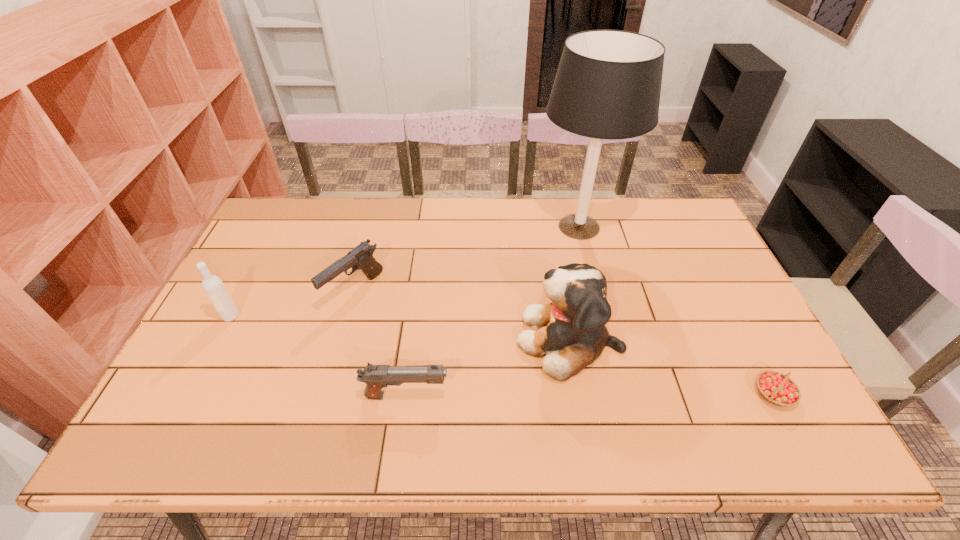
Find the location of a particular element. The width and height of the screenshot is (960, 540). the shortest object is located at coordinates (778, 389).

The width and height of the screenshot is (960, 540). Identify the location of free region located 0.150m on the left of the farthest object. (490, 227).

Where is `vacant space positioned 0.340m at the face of the puppy`? vacant space positioned 0.340m at the face of the puppy is located at coordinates (387, 340).

Find the location of a particular element. The width and height of the screenshot is (960, 540). vacant space located 0.080m at the face of the puppy is located at coordinates (486, 340).

The width and height of the screenshot is (960, 540). What are the coordinates of `vacant space located at the face of the puppy` in the screenshot? It's located at (418, 340).

Image resolution: width=960 pixels, height=540 pixels. Identify the location of vacant point located on the front of the leftmost object. pos(198,380).

This screenshot has width=960, height=540. Find the location of `vacant space located 0.240m at the muzzle of the fifth object from right to left`. vacant space located 0.240m at the muzzle of the fifth object from right to left is located at coordinates (326, 393).

Where is `vacant space located in the direction the fourth object from right to left is aimed`? The width and height of the screenshot is (960, 540). vacant space located in the direction the fourth object from right to left is aimed is located at coordinates point(487,396).

I want to click on free space located on the left of the strawberry, so point(657,394).

Where is `object at the far edge`? object at the far edge is located at coordinates (608, 84).